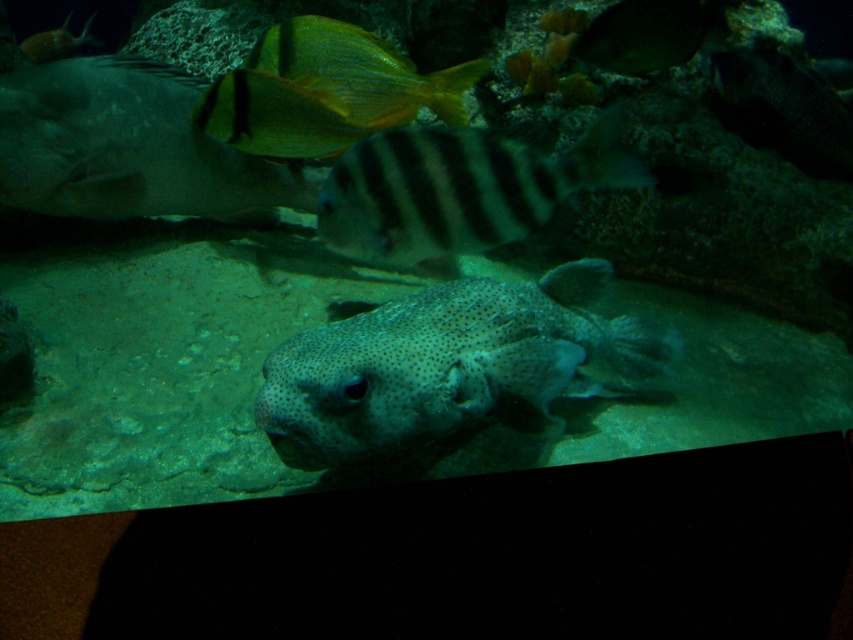
You are an underwater photographer aiming to capture a clear shot of the dark textured fish at upper right. You are currently positioned at point (785, 108). Can you take the photo without moving your position?

Yes, you can take the photo without moving because the dark textured fish at upper right is located exactly at point (785, 108) where you are positioned.

You are a marine biologist observing an underwater scene. You notice a point marked at coordinates (x=462, y=188). Based on the scene description, which object does this point correspond to?

The point at coordinates (x=462, y=188) is located on the dark gray striped fish at center.